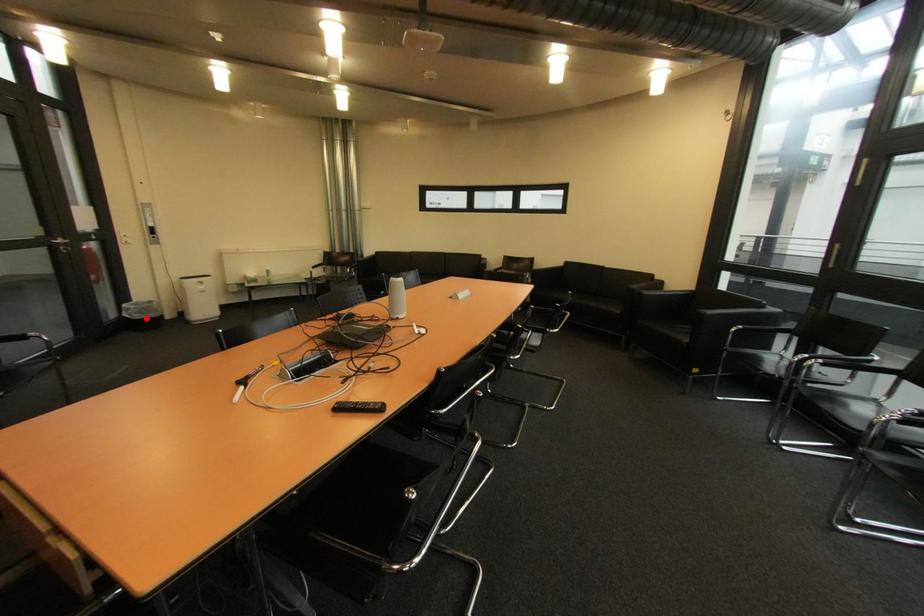
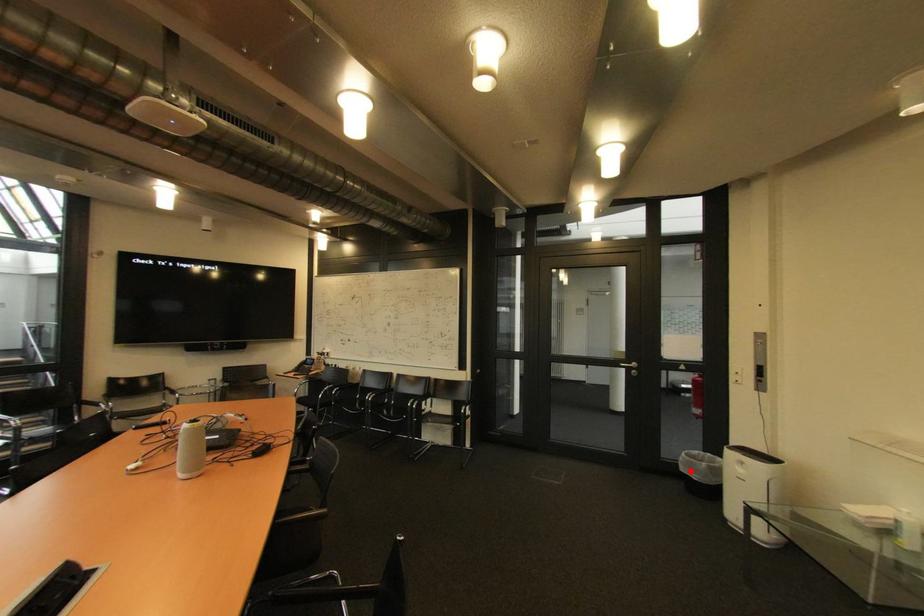
I am providing you with two images of the same scene from different viewpoints. A red point is marked on the first image and another point is marked on the second image. Do the highlighted points in image1 and image2 indicate the same real-world spot?

Yes